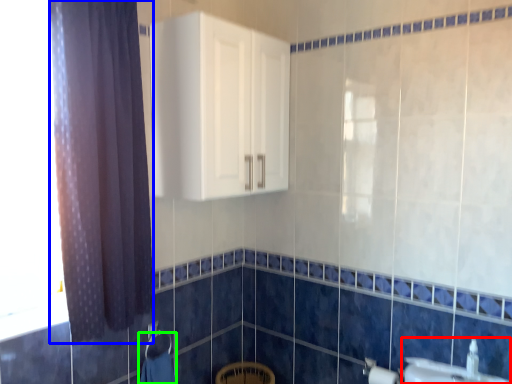
Question: Considering the real-world distances, which object is closest to sink (highlighted by a red box)? curtain (highlighted by a blue box) or bath towel (highlighted by a green box).

Choices:
 (A) curtain
 (B) bath towel

Answer: (B)